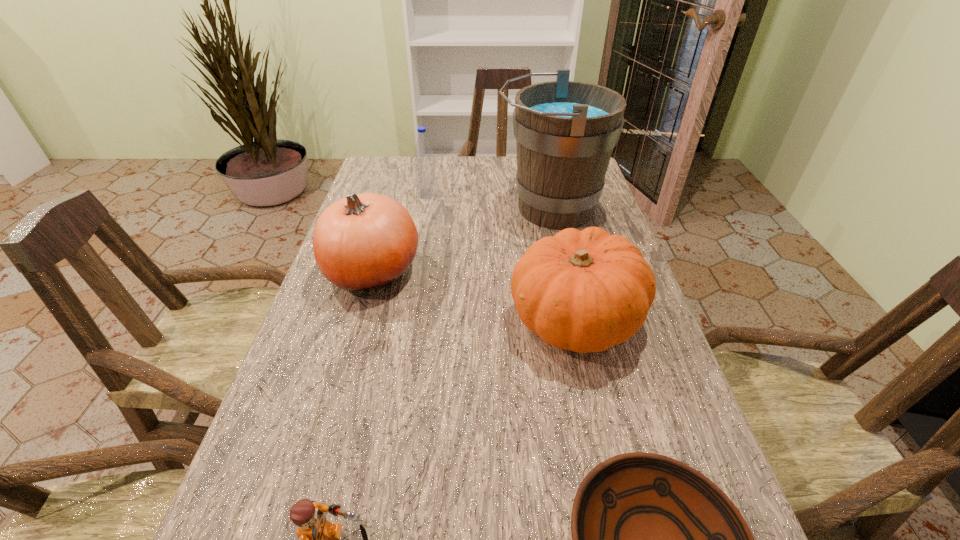
You are a GUI agent. You are given a task and a screenshot of the screen. Output one action in this format:
    pyautogui.click(x=<x>, y=<y>)
    Task: Click on the wine bucket located in the far edge section of the desktop
    This screenshot has height=540, width=960.
    Given the screenshot: What is the action you would take?
    pyautogui.click(x=565, y=131)

Image resolution: width=960 pixels, height=540 pixels. Find the location of `water bottle positioned at the far edge`. water bottle positioned at the far edge is located at coordinates (425, 175).

Where is `object located at the left edge`? This screenshot has width=960, height=540. object located at the left edge is located at coordinates (366, 241).

The width and height of the screenshot is (960, 540). I want to click on wine bucket at the right edge, so click(x=565, y=131).

I want to click on pumpkin present at the right edge, so click(x=585, y=291).

What are the coordinates of `object situated at the far right corner` in the screenshot? It's located at (565, 131).

In the image, there is a desktop. Where is `vacant space at the far edge`? The height and width of the screenshot is (540, 960). vacant space at the far edge is located at coordinates (449, 168).

In the image, there is a desktop. Find the location of `free space at the left edge`. free space at the left edge is located at coordinates (362, 322).

Locate an element on the screen. This screenshot has height=540, width=960. free region at the far left corner of the desktop is located at coordinates (405, 176).

The width and height of the screenshot is (960, 540). I want to click on vacant area that lies between the water bottle and the shorter pumpkin, so click(x=501, y=256).